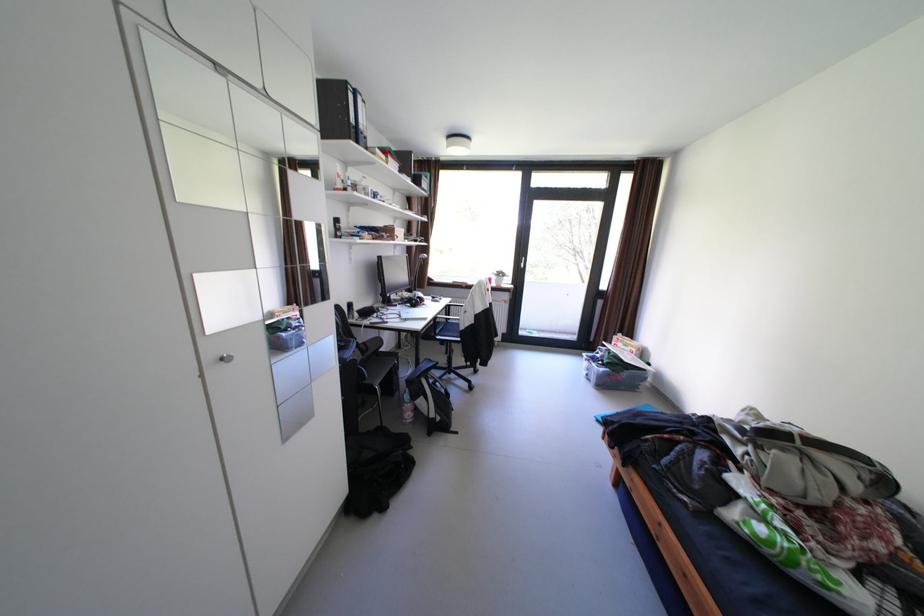
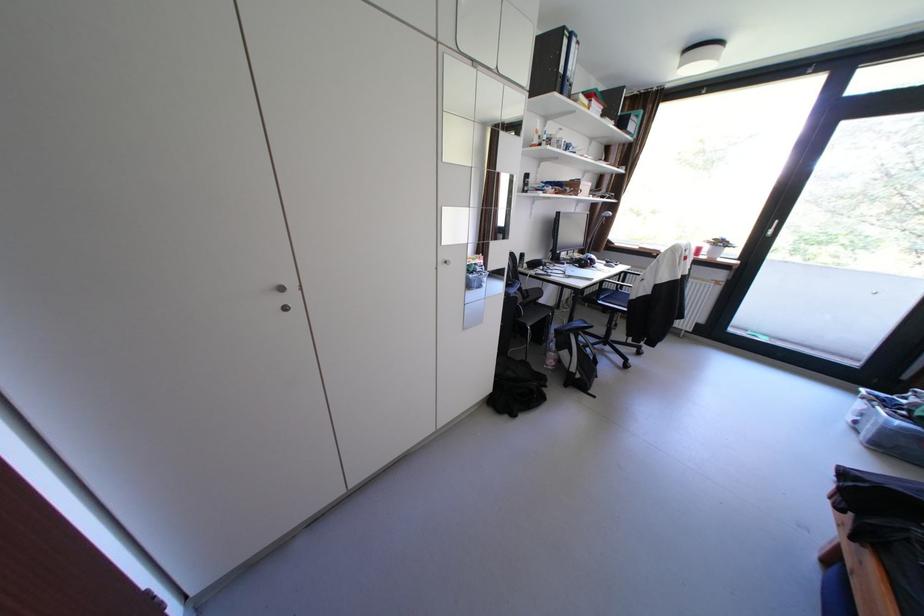
The point at [432,397] is marked in the first image. Where is the corresponding point in the second image?

(578, 351)